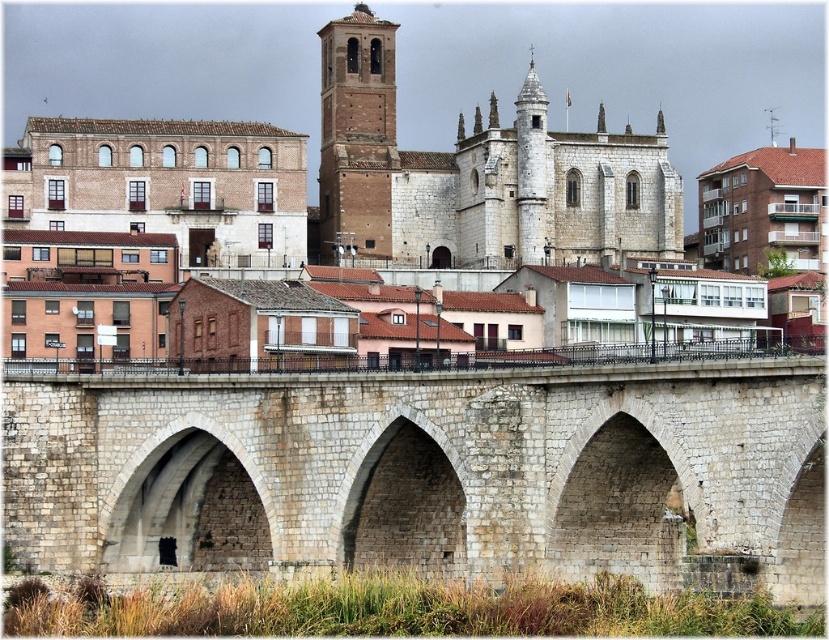
Looking at this image, does white stone church at center have a smaller size compared to brown brick tower at upper center?

No.

Locate an element on the screen. white stone church at center is located at coordinates (618, 70).

Where is `white stone church at center`? white stone church at center is located at coordinates (618, 70).

Can you confirm if white stone church at center is positioned below white stone arch at center?

Actually, white stone church at center is above white stone arch at center.

Is white stone church at center behind white stone arch at center?

Yes.

The image size is (829, 640). I want to click on white stone church at center, so click(x=618, y=70).

Who is shorter, white stone bridge at lower center or white stone arch at center?

white stone arch at center is shorter.

Consider the image. Can you confirm if white stone bridge at lower center is thinner than white stone arch at center?

No.

Which is in front, point (481, 500) or point (376, 538)?

Point (481, 500) is more forward.

Locate an element on the screen. Image resolution: width=829 pixels, height=640 pixels. white stone bridge at lower center is located at coordinates (427, 472).